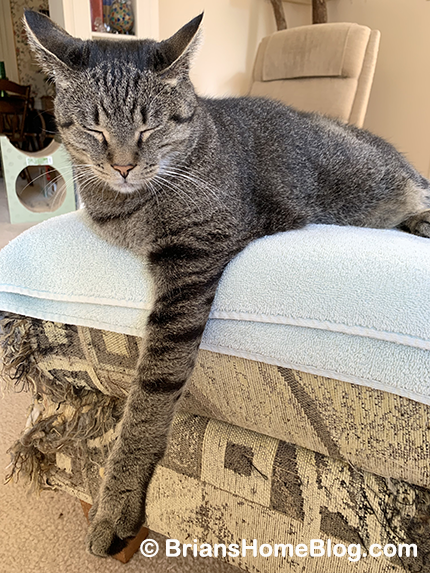
Where is `cushion`? cushion is located at coordinates (253, 403).